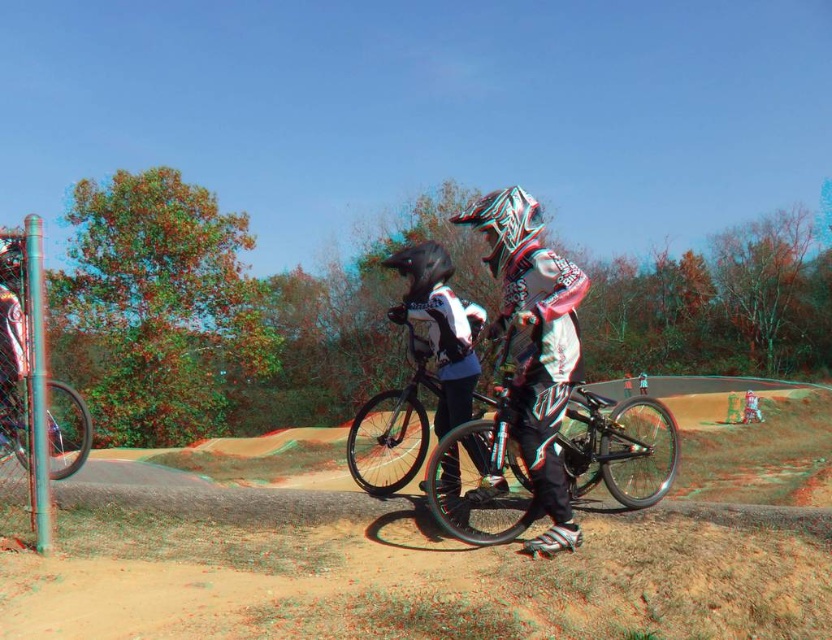
Based on the photo, does shiny metallic helmet at center appear on the left side of shiny black helmet at center?

Incorrect, shiny metallic helmet at center is not on the left side of shiny black helmet at center.

Which is behind, point (538, 216) or point (404, 268)?

Point (404, 268)

Who is more forward, [520,198] or [392,259]?

Point [520,198]

In order to click on shiny metallic helmet at center in this screenshot , I will do `click(504, 225)`.

Is shiny metallic helmet at center below shiny black helmet at upper left?

No.

Does shiny metallic helmet at center have a lesser height compared to shiny black helmet at upper left?

No, shiny metallic helmet at center is not shorter than shiny black helmet at upper left.

Measure the distance between point (501, 241) and camera.

Point (501, 241) is 16.28 feet away from camera.

The image size is (832, 640). Identify the location of shiny metallic helmet at center. (504, 225).

Who is positioned more to the left, shiny black helmet at center or shiny black helmet at upper left?

shiny black helmet at upper left is more to the left.

Between shiny black helmet at center and shiny black helmet at upper left, which one appears on the right side from the viewer's perspective?

shiny black helmet at center is more to the right.

The image size is (832, 640). I want to click on shiny black helmet at center, so click(419, 268).